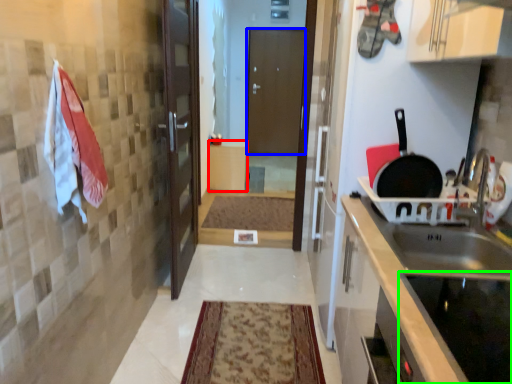
Question: Estimate the real-world distances between objects in this image. Which object is closer to cabinetry (highlighted by a red box), door (highlighted by a blue box) or appliance (highlighted by a green box)?

Choices:
 (A) door
 (B) appliance

Answer: (A)